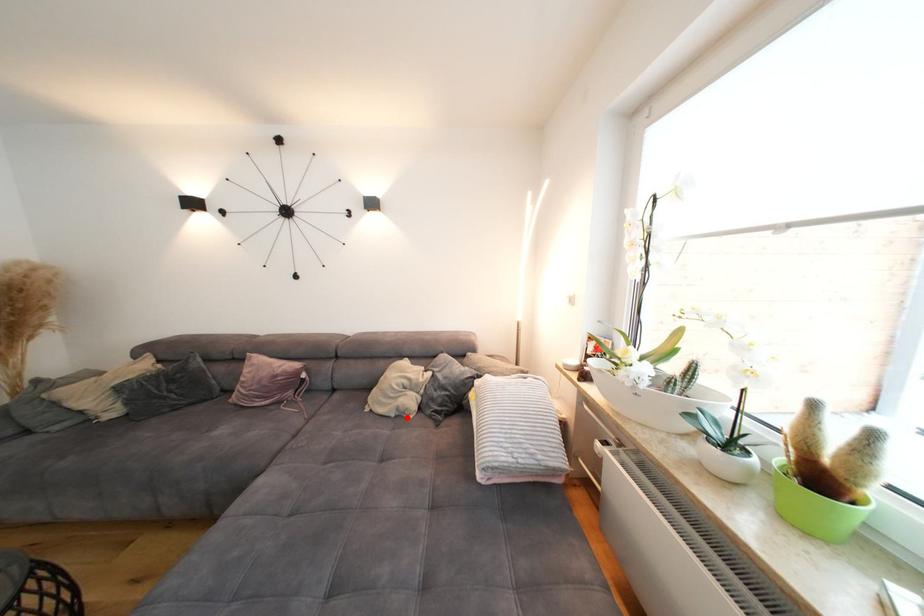
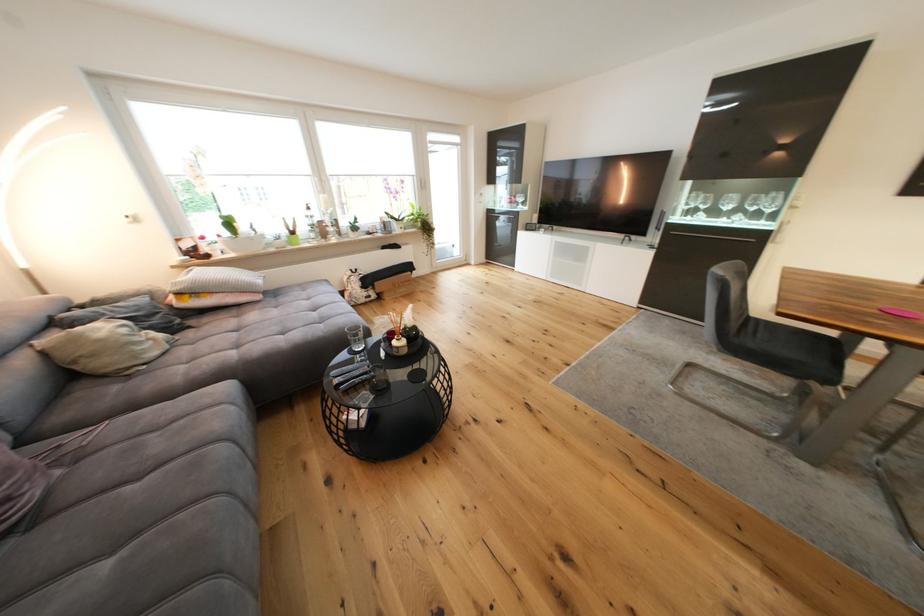
Question: A red point is marked in image1. In image2, is the corresponding 3D point closer to the camera or farther? Reply with the corresponding letter.

Choices:
 (A) The corresponding 3D point is closer.
 (B) The corresponding 3D point is farther.

Answer: (A)